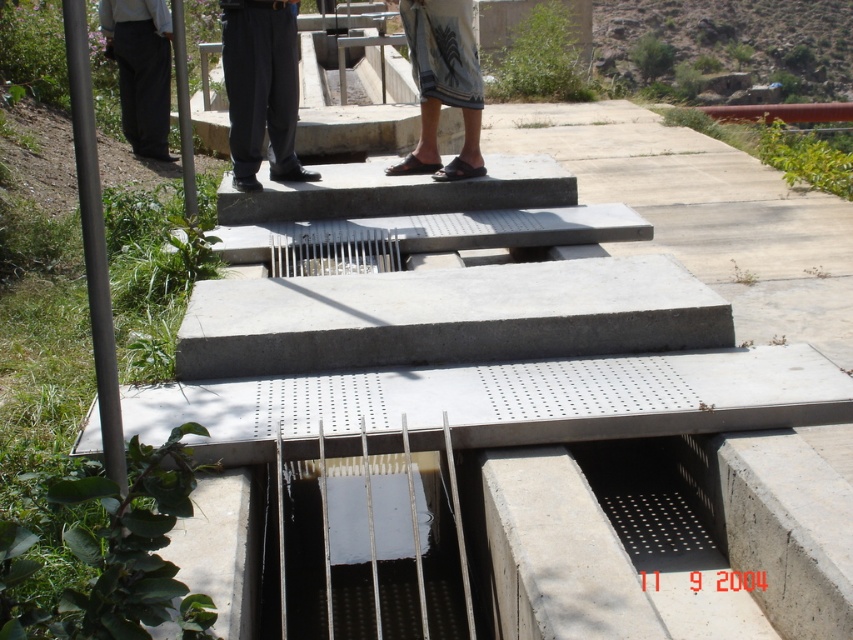
Does point (260, 161) come closer to viewer compared to point (436, 163)?

That is True.

You are a GUI agent. You are given a task and a screenshot of the screen. Output one action in this format:
    pyautogui.click(x=<x>, y=<y>)
    Task: Click on the dark gray pants at upper center
    The image size is (853, 640).
    Given the screenshot: What is the action you would take?
    tap(260, 88)

Who is more distant from viewer, (248, 134) or (427, 108)?

Point (427, 108)

Find the location of a particular element. dark gray pants at upper center is located at coordinates (260, 88).

Based on the photo, measure the distance from dark gray pants at upper center to dark gray pants at left.

3.29 meters

Between dark gray pants at upper center and dark gray pants at left, which one appears on the right side from the viewer's perspective?

From the viewer's perspective, dark gray pants at upper center appears more on the right side.

Is point (285, 51) farther from viewer compared to point (137, 36)?

That is False.

Identify the location of dark gray pants at upper center. This screenshot has width=853, height=640. (260, 88).

Between white woven cloth at center and dark gray pants at left, which one has less height?

white woven cloth at center is shorter.

Can you confirm if white woven cloth at center is bigger than dark gray pants at left?

Incorrect, white woven cloth at center is not larger than dark gray pants at left.

Between point (412, 67) and point (160, 12), which one is positioned in front?

Point (412, 67)

Where is `white woven cloth at center`? The width and height of the screenshot is (853, 640). white woven cloth at center is located at coordinates (442, 83).